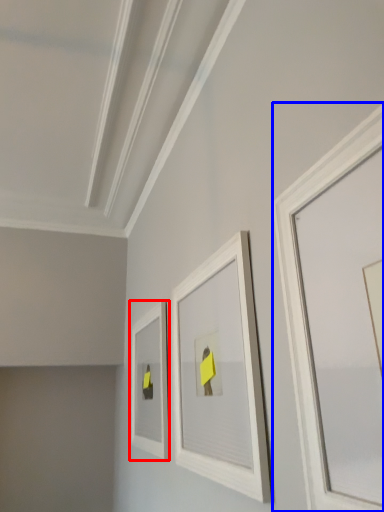
Question: Which object is further to the camera taking this photo, picture frame (highlighted by a red box) or picture frame (highlighted by a blue box)?

Choices:
 (A) picture frame
 (B) picture frame

Answer: (A)